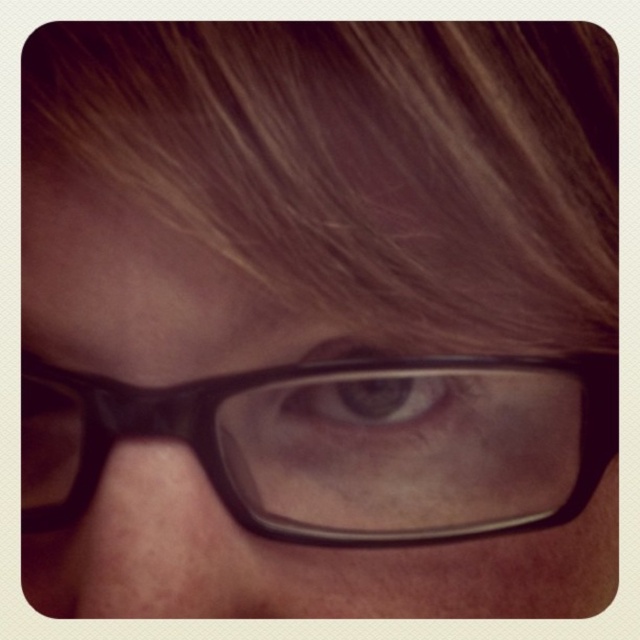
Does point (272, 554) come behind point (376, 362)?

Yes, point (272, 554) is farther from viewer.

Between point (288, 579) and point (339, 356), which one is positioned behind?

Point (288, 579)

What are the coordinates of `black matte glasses at center` in the screenshot? It's located at (298, 561).

Does black matte glasses at center appear under black plastic glasses at center?

Yes.

Does black matte glasses at center have a larger size compared to black plastic glasses at center?

Indeed, black matte glasses at center has a larger size compared to black plastic glasses at center.

Is point (172, 550) farther from viewer compared to point (429, 506)?

No, it is in front of (429, 506).

Identify the location of black matte glasses at center. (298, 561).

Who is more distant from viewer, (266, 404) or (358, 374)?

Positioned behind is point (266, 404).

Identify the location of black plastic glasses at center. [342, 444].